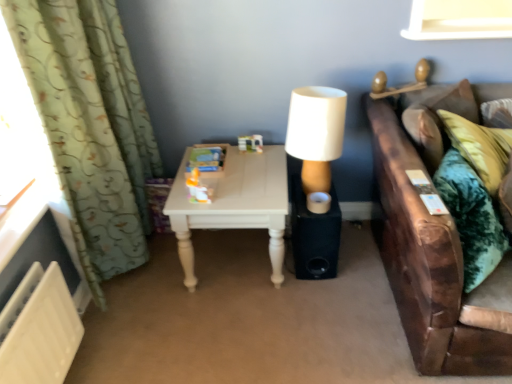
Question: From a real-world perspective, is white painted wood table at center positioned under black matte speaker at lower right based on gravity?

Choices:
 (A) no
 (B) yes

Answer: (A)

Question: Can you confirm if white painted wood table at center is positioned to the left of black matte speaker at lower right?

Choices:
 (A) no
 (B) yes

Answer: (B)

Question: Is white painted wood table at center placed right next to black matte speaker at lower right?

Choices:
 (A) no
 (B) yes

Answer: (A)

Question: From a real-world perspective, does white painted wood table at center stand above black matte speaker at lower right?

Choices:
 (A) yes
 (B) no

Answer: (A)

Question: Does white painted wood table at center lie behind black matte speaker at lower right?

Choices:
 (A) no
 (B) yes

Answer: (A)

Question: From a real-world perspective, is white painted wood table at center above or below velvet green couch at right?

Choices:
 (A) below
 (B) above

Answer: (A)

Question: Which is correct: white painted wood table at center is inside velvet green couch at right, or outside of it?

Choices:
 (A) outside
 (B) inside

Answer: (A)

Question: From the image's perspective, is white painted wood table at center above or below velvet green couch at right?

Choices:
 (A) below
 (B) above

Answer: (A)

Question: Considering the relative positions of white painted wood table at center and velvet green couch at right in the image provided, is white painted wood table at center to the left or to the right of velvet green couch at right?

Choices:
 (A) right
 (B) left

Answer: (B)

Question: Is point (309, 258) positioned closer to the camera than point (193, 195)?

Choices:
 (A) farther
 (B) closer

Answer: (A)

Question: Is black matte speaker at lower right wider or thinner than translucent plastic toy at center?

Choices:
 (A) wide
 (B) thin

Answer: (A)

Question: In terms of height, does black matte speaker at lower right look taller or shorter compared to translucent plastic toy at center?

Choices:
 (A) short
 (B) tall

Answer: (B)

Question: Considering their positions, is black matte speaker at lower right located in front of or behind translucent plastic toy at center?

Choices:
 (A) behind
 (B) front

Answer: (A)

Question: Is translucent plastic toy at center to the left or to the right of black matte speaker at lower right in the image?

Choices:
 (A) left
 (B) right

Answer: (A)

Question: Considering their positions, is translucent plastic toy at center located in front of or behind black matte speaker at lower right?

Choices:
 (A) behind
 (B) front

Answer: (B)